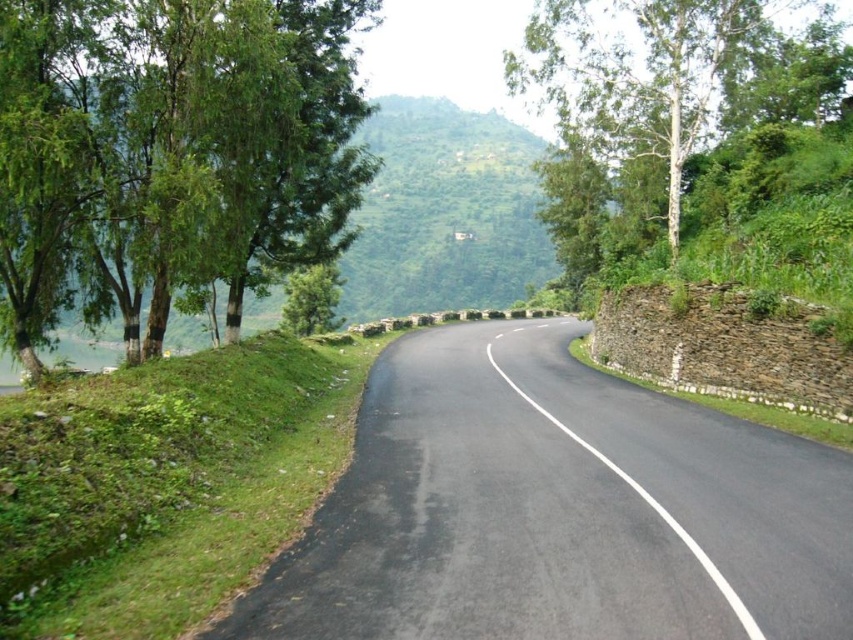
Question: Is black asphalt road at center further to the viewer compared to white smooth tree at upper center?

Choices:
 (A) no
 (B) yes

Answer: (A)

Question: Which point is farther to the camera?

Choices:
 (A) (637, 173)
 (B) (328, 100)
 (C) (486, 627)

Answer: (A)

Question: Does black asphalt road at center appear on the right side of green leafy tree at left?

Choices:
 (A) yes
 (B) no

Answer: (A)

Question: Estimate the real-world distances between objects in this image. Which object is closer to the white smooth tree at upper center?

Choices:
 (A) black asphalt road at center
 (B) green leafy tree at left

Answer: (B)

Question: Is black asphalt road at center above white smooth tree at upper center?

Choices:
 (A) yes
 (B) no

Answer: (B)

Question: Which point is farther to the camera?

Choices:
 (A) white smooth tree at upper center
 (B) green leafy tree at left

Answer: (A)